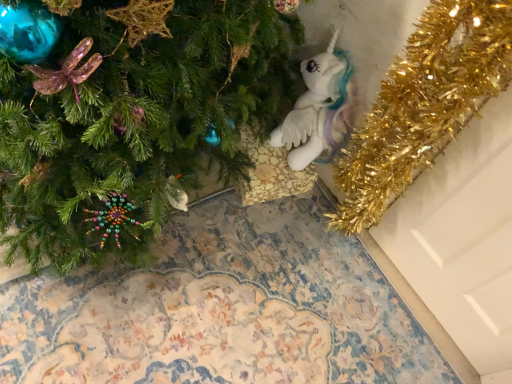
This screenshot has height=384, width=512. What do you see at coordinates (135, 118) in the screenshot?
I see `green matte christmas tree at lower left` at bounding box center [135, 118].

In order to click on green matte christmas tree at lower left in this screenshot , I will do `click(135, 118)`.

In order to face green matte christmas tree at lower left, should I rotate leftwards or rightwards?

To align with it, rotate left about 19.738°.

This screenshot has width=512, height=384. Describe the element at coordinates (318, 110) in the screenshot. I see `white plush unicorn at center` at that location.

Measure the distance between white plush unicorn at center and camera.

white plush unicorn at center and camera are 4.31 feet apart from each other.

Identify the location of white plush unicorn at center. (318, 110).

Image resolution: width=512 pixels, height=384 pixels. What are the coordinates of `green matte christmas tree at lower left` in the screenshot? It's located at (135, 118).

Is green matte christmas tree at lower left at the right side of white plush unicorn at center?

No, green matte christmas tree at lower left is not to the right of white plush unicorn at center.

Is green matte christmas tree at lower left further to camera compared to white plush unicorn at center?

No, green matte christmas tree at lower left is closer to the camera.

Does point (25, 172) lie behind point (287, 135)?

No, (25, 172) is closer to viewer.

From the image's perspective, is green matte christmas tree at lower left on white plush unicorn at center?

Incorrect, from the image's perspective, green matte christmas tree at lower left is lower than white plush unicorn at center.

From a real-world perspective, which is physically below, green matte christmas tree at lower left or white plush unicorn at center?

In real-world perspective, green matte christmas tree at lower left is lower.

Which of these two, green matte christmas tree at lower left or white plush unicorn at center, is thinner?

Thinner between the two is white plush unicorn at center.

Looking at this image, is green matte christmas tree at lower left shorter than white plush unicorn at center?

Yes, green matte christmas tree at lower left is shorter than white plush unicorn at center.

In the scene shown: Considering the sizes of objects green matte christmas tree at lower left and white plush unicorn at center in the image provided, who is smaller, green matte christmas tree at lower left or white plush unicorn at center?

Smaller between the two is white plush unicorn at center.

Which is correct: green matte christmas tree at lower left is inside white plush unicorn at center, or outside of it?

green matte christmas tree at lower left exists outside the volume of white plush unicorn at center.

Is green matte christmas tree at lower left not close to white plush unicorn at center?

No, green matte christmas tree at lower left is not far from white plush unicorn at center.

Is green matte christmas tree at lower left looking in the opposite direction of white plush unicorn at center?

green matte christmas tree at lower left is not turned away from white plush unicorn at center.

How distant is green matte christmas tree at lower left from white plush unicorn at center?

green matte christmas tree at lower left is 16.55 inches away from white plush unicorn at center.

In the image, there is a white plush unicorn at center. Identify the location of christmas tree below it (from the image's perspective). This screenshot has height=384, width=512. (135, 118).

Which is more to the right, white plush unicorn at center or green matte christmas tree at lower left?

white plush unicorn at center is more to the right.

Is white plush unicorn at center in front of or behind green matte christmas tree at lower left in the image?

white plush unicorn at center is behind green matte christmas tree at lower left.

Considering the positions of point (325, 82) and point (247, 11), is point (325, 82) closer or farther from the camera than point (247, 11)?

Point (325, 82) is positioned farther from the camera compared to point (247, 11).

From the image's perspective, is white plush unicorn at center positioned above or below green matte christmas tree at lower left?

Based on their image positions, white plush unicorn at center is located above green matte christmas tree at lower left.

From a real-world perspective, between white plush unicorn at center and green matte christmas tree at lower left, who is vertically higher?

From a 3D spatial view, white plush unicorn at center is above.

Does white plush unicorn at center have a lesser width compared to green matte christmas tree at lower left?

Correct, the width of white plush unicorn at center is less than that of green matte christmas tree at lower left.

Does white plush unicorn at center have a lesser height compared to green matte christmas tree at lower left?

No, white plush unicorn at center is not shorter than green matte christmas tree at lower left.

Who is smaller, white plush unicorn at center or green matte christmas tree at lower left?

white plush unicorn at center is smaller.

Can we say white plush unicorn at center lies outside green matte christmas tree at lower left?

Yes, white plush unicorn at center is located beyond the bounds of green matte christmas tree at lower left.

Would you say white plush unicorn at center is a long distance from green matte christmas tree at lower left?

white plush unicorn at center is actually quite close to green matte christmas tree at lower left.

Based on the photo, is white plush unicorn at center facing away from green matte christmas tree at lower left?

No, white plush unicorn at center is not facing the opposite direction of green matte christmas tree at lower left.

How many degrees apart are the facing directions of white plush unicorn at center and green matte christmas tree at lower left?

The angle between the facing direction of white plush unicorn at center and the facing direction of green matte christmas tree at lower left is 94.1 degrees.

Identify the location of christmas tree that is in front of the white plush unicorn at center. The image size is (512, 384). (135, 118).

At what (x,y) coordinates should I click in order to perform the action: click on christmas tree on the left of white plush unicorn at center. Please return your answer as a coordinate pair (x, y). Image resolution: width=512 pixels, height=384 pixels. Looking at the image, I should click on (135, 118).

Locate an element on the screen. The height and width of the screenshot is (384, 512). christmas tree directly beneath the white plush unicorn at center (from a real-world perspective) is located at coordinates (135, 118).